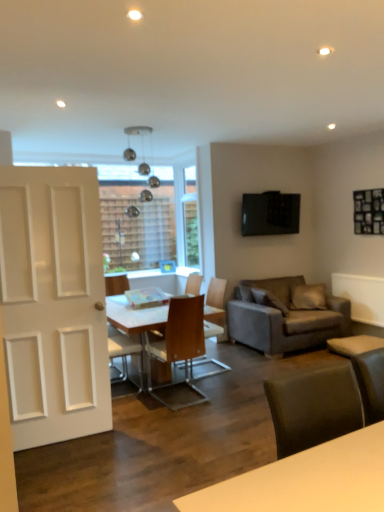
Question: Is wooden chair at center, which ranks as the fourth chair in front-to-back order, positioned behind light brown wooden chair at center, which ranks as the third chair in back-to-front order?

Choices:
 (A) no
 (B) yes

Answer: (B)

Question: From a real-world perspective, does wooden chair at center, which ranks as the fourth chair in front-to-back order, stand above light brown wooden chair at center, which ranks as the third chair in back-to-front order?

Choices:
 (A) yes
 (B) no

Answer: (A)

Question: Is wooden chair at center, which appears as the first chair when viewed from the back, facing towards light brown wooden chair at center, which ranks as the third chair in back-to-front order?

Choices:
 (A) yes
 (B) no

Answer: (B)

Question: Is light brown wooden chair at center, which ranks as the third chair in back-to-front order, completely or partially inside wooden chair at center, which ranks as the fourth chair in front-to-back order?

Choices:
 (A) no
 (B) yes

Answer: (A)

Question: Is wooden chair at center, which appears as the first chair when viewed from the back, outside of light brown wooden chair at center, which ranks as the third chair in back-to-front order?

Choices:
 (A) yes
 (B) no

Answer: (A)

Question: From the image's perspective, is metallic glass light fixture at upper center located above or below wooden chair at center, positioned as the 2th chair in back-to-front order?

Choices:
 (A) above
 (B) below

Answer: (A)

Question: Is metallic glass light fixture at upper center taller or shorter than wooden chair at center, marked as the 3th chair in a front-to-back arrangement?

Choices:
 (A) short
 (B) tall

Answer: (A)

Question: Do you think metallic glass light fixture at upper center is within wooden chair at center, positioned as the 2th chair in back-to-front order, or outside of it?

Choices:
 (A) inside
 (B) outside

Answer: (B)

Question: Looking at their shapes, would you say metallic glass light fixture at upper center is wider or thinner than wooden chair at center, positioned as the 2th chair in back-to-front order?

Choices:
 (A) thin
 (B) wide

Answer: (A)

Question: In terms of size, does light brown wooden chair at center, which ranks as the third chair in back-to-front order, appear bigger or smaller than white glossy table at center?

Choices:
 (A) big
 (B) small

Answer: (B)

Question: Is light brown wooden chair at center, placed as the second chair when sorted from front to back, in front of or behind white glossy table at center in the image?

Choices:
 (A) front
 (B) behind

Answer: (B)

Question: From a real-world perspective, is light brown wooden chair at center, placed as the second chair when sorted from front to back, above or below white glossy table at center?

Choices:
 (A) above
 (B) below

Answer: (A)

Question: Is light brown wooden chair at center, which ranks as the third chair in back-to-front order, spatially inside white glossy table at center, or outside of it?

Choices:
 (A) inside
 (B) outside

Answer: (A)

Question: From a real-world perspective, is wooden chair at center, which appears as the first chair when viewed from the back, above or below wooden chair at center, marked as the 3th chair in a front-to-back arrangement?

Choices:
 (A) above
 (B) below

Answer: (B)

Question: Considering the relative positions of wooden chair at center, which ranks as the fourth chair in front-to-back order, and wooden chair at center, positioned as the 2th chair in back-to-front order, in the image provided, is wooden chair at center, which ranks as the fourth chair in front-to-back order, to the left or to the right of wooden chair at center, positioned as the 2th chair in back-to-front order,?

Choices:
 (A) left
 (B) right

Answer: (A)